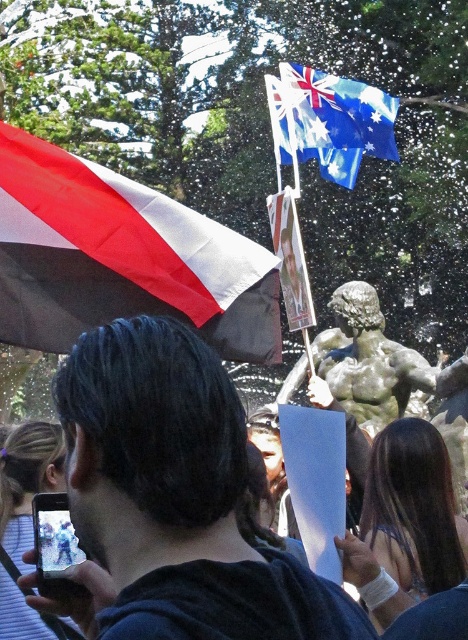
Can you confirm if dark blue fabric at center is positioned to the left of blue fabric flag at upper center?

Correct, you'll find dark blue fabric at center to the left of blue fabric flag at upper center.

Does dark blue fabric at center have a lesser width compared to blue fabric flag at upper center?

In fact, dark blue fabric at center might be wider than blue fabric flag at upper center.

Does point (178, 381) come closer to viewer compared to point (394, 141)?

Yes, it is.

Where is `dark blue fabric at center`? The width and height of the screenshot is (468, 640). dark blue fabric at center is located at coordinates (173, 500).

Between dark blue fabric at center and red and white striped flag at upper left, which one has less height?

Standing shorter between the two is dark blue fabric at center.

Can you confirm if dark blue fabric at center is positioned below red and white striped flag at upper left?

Indeed, dark blue fabric at center is positioned under red and white striped flag at upper left.

From the picture: Who is more distant from viewer, (156, 333) or (51, 150)?

The point (51, 150) is more distant.

The height and width of the screenshot is (640, 468). What are the coordinates of `dark blue fabric at center` in the screenshot? It's located at (173, 500).

What do you see at coordinates (121, 257) in the screenshot? I see `red and white striped flag at upper left` at bounding box center [121, 257].

Who is more distant from viewer, (204,300) or (336,113)?

The point (336,113) is behind.

Locate an element on the screen. The image size is (468, 640). red and white striped flag at upper left is located at coordinates (121, 257).